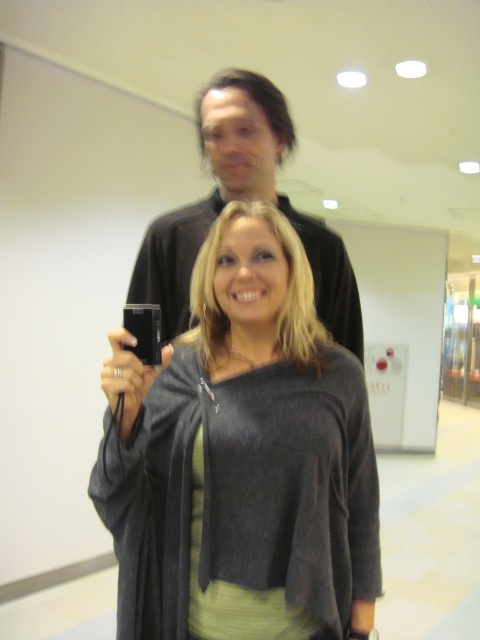
You are a photographer trying to capture a photo of both the matte black camera at center and the black matte camera at upper center in the frame. Which camera should you position to the left to ensure both are in the shot?

You should position the matte black camera at center to the left since it is already on the left side of the black matte camera at upper center, ensuring both are in the frame.

You are a photographer who wants to choose a camera for a closeup portrait. The matte black camera at center and the black matte camera at upper center are both available. Which camera should you pick if you want the one that is taller?

The matte black camera at center has a greater height compared to the black matte camera at upper center, so you should pick the matte black camera at center.

You are a photographer trying to set up two cameras for a photo shoot. You have a matte black camera at center and a black matte camera at upper center. The space between them is limited. What is the minimum distance you need to maintain between the two cameras to ensure they are properly positioned?

The minimum distance you need to maintain between the matte black camera at center and the black matte camera at upper center is 15.05 inches to ensure proper positioning.